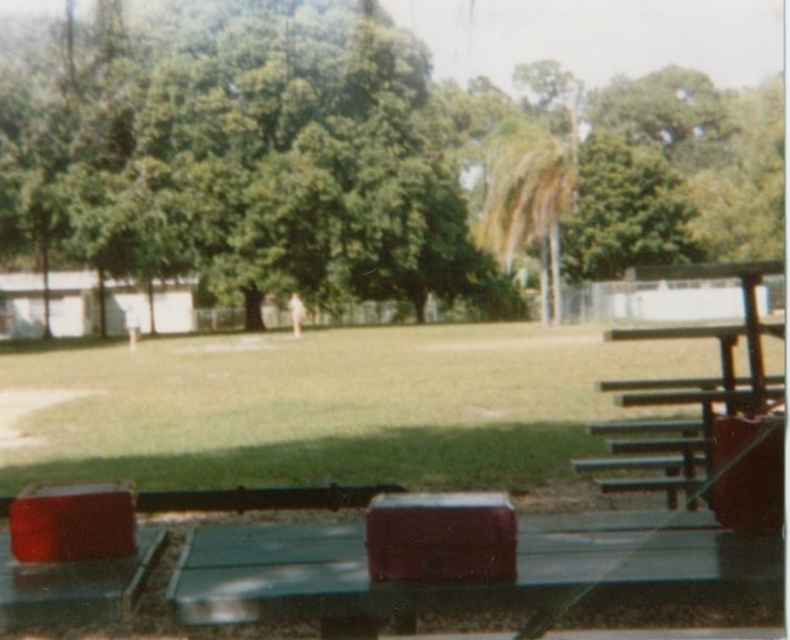
Can you confirm if green grass at center is bigger than metallic green picnic table at lower center?

Correct, green grass at center is larger in size than metallic green picnic table at lower center.

Between green grass at center and metallic green picnic table at lower center, which one is positioned lower?

metallic green picnic table at lower center is lower down.

Which is in front, point (407, 365) or point (247, 563)?

Positioned in front is point (247, 563).

Identify the location of green grass at center. (333, 406).

Does metallic green picnic table at lower center have a greater width compared to green metal picnic table at right?

In fact, metallic green picnic table at lower center might be narrower than green metal picnic table at right.

Does metallic green picnic table at lower center appear on the left side of green metal picnic table at right?

Yes, metallic green picnic table at lower center is to the left of green metal picnic table at right.

Who is more distant from viewer, (687, 545) or (621, 401)?

The point (621, 401) is more distant.

Identify the location of metallic green picnic table at lower center. This screenshot has height=640, width=790. (465, 584).

You are a GUI agent. You are given a task and a screenshot of the screen. Output one action in this format:
    pyautogui.click(x=<x>, y=<y>)
    Task: Click on the green leafy tree at upper left
    The height and width of the screenshot is (640, 790).
    Given the screenshot: What is the action you would take?
    pyautogui.click(x=239, y=154)

Which is in front, point (72, 80) or point (532, 593)?

Point (532, 593) is in front.

I want to click on green leafy tree at upper left, so click(239, 154).